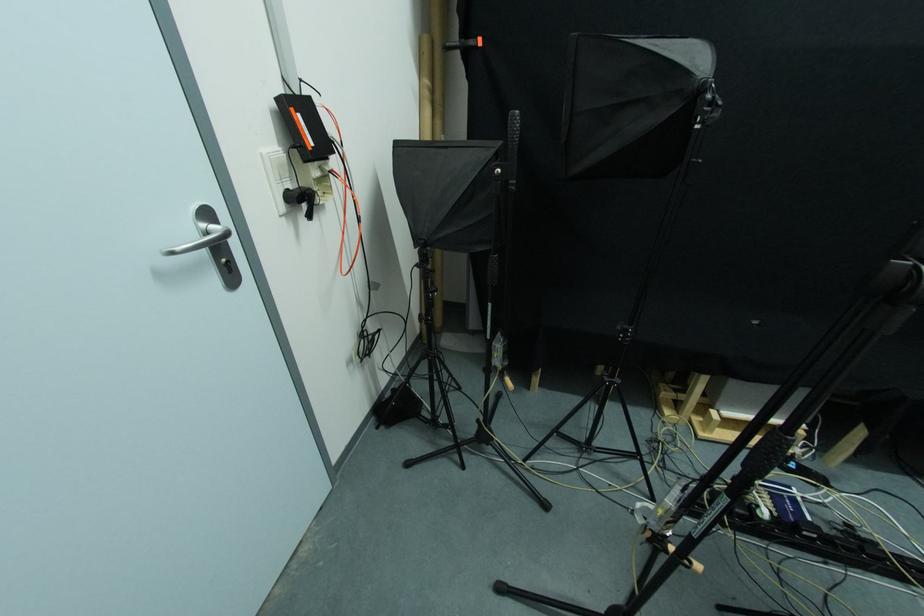
Locate an element on the screen. door keyhole is located at coordinates (226, 265).